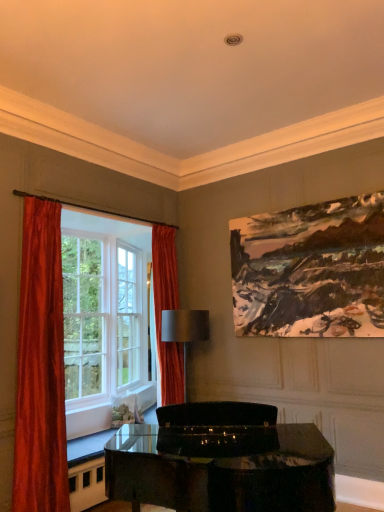
Question: From a real-world perspective, is satin gray lampshade at center located beneath silky red curtains at left?

Choices:
 (A) no
 (B) yes

Answer: (B)

Question: Does satin gray lampshade at center have a greater height compared to silky red curtains at left?

Choices:
 (A) yes
 (B) no

Answer: (B)

Question: Can you see satin gray lampshade at center touching silky red curtains at left?

Choices:
 (A) yes
 (B) no

Answer: (B)

Question: Is silky red curtains at left located within satin gray lampshade at center?

Choices:
 (A) no
 (B) yes

Answer: (A)

Question: Considering the relative sizes of satin gray lampshade at center and silky red curtains at left in the image provided, is satin gray lampshade at center wider than silky red curtains at left?

Choices:
 (A) yes
 (B) no

Answer: (B)

Question: Is satin gray lampshade at center outside silky red curtains at left?

Choices:
 (A) no
 (B) yes

Answer: (B)

Question: Considering the relative sizes of silky red curtains at left and oil painting at upper right in the image provided, is silky red curtains at left shorter than oil painting at upper right?

Choices:
 (A) yes
 (B) no

Answer: (B)

Question: Are silky red curtains at left and oil painting at upper right located far from each other?

Choices:
 (A) no
 (B) yes

Answer: (B)

Question: Can you confirm if silky red curtains at left is taller than oil painting at upper right?

Choices:
 (A) yes
 (B) no

Answer: (A)

Question: Is oil painting at upper right inside silky red curtains at left?

Choices:
 (A) no
 (B) yes

Answer: (A)

Question: Does silky red curtains at left appear on the right side of oil painting at upper right?

Choices:
 (A) no
 (B) yes

Answer: (A)

Question: Does silky red curtains at left have a lesser width compared to oil painting at upper right?

Choices:
 (A) yes
 (B) no

Answer: (B)

Question: Considering the relative sizes of orange velvet curtain at left, which appears as the first curtain when viewed from the right, and velvet orange curtain at left, the second curtain viewed from the right, in the image provided, is orange velvet curtain at left, which appears as the first curtain when viewed from the right, wider than velvet orange curtain at left, the second curtain viewed from the right,?

Choices:
 (A) no
 (B) yes

Answer: (B)